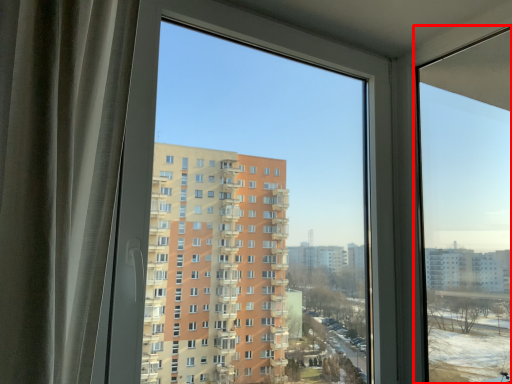
Question: From the image's perspective, what is the correct spatial relationship of window (annotated by the red box) in relation to window screen?

Choices:
 (A) above
 (B) below

Answer: (B)